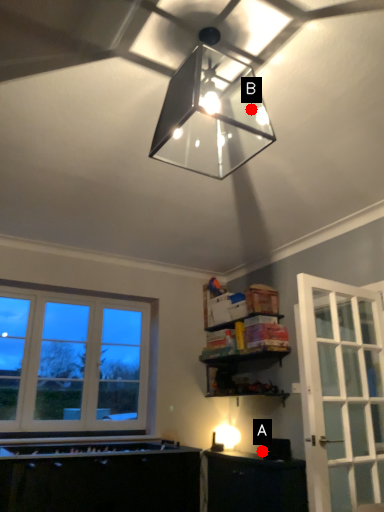
Question: Two points are circled on the image, labeled by A and B beside each circle. Which point appears farthest from the camera in this image?

Choices:
 (A) A is further
 (B) B is further

Answer: (A)